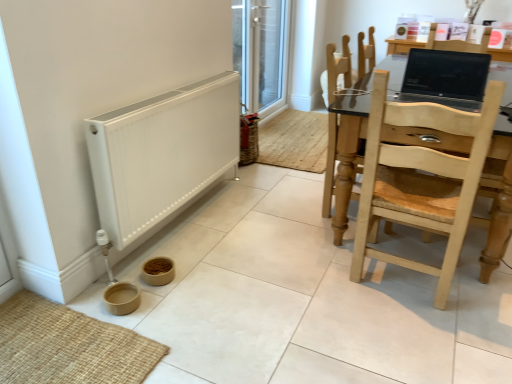
Image resolution: width=512 pixels, height=384 pixels. What are the coordinates of `vacant area that lies to the right of white matte heater at lower left` in the screenshot? It's located at (273, 228).